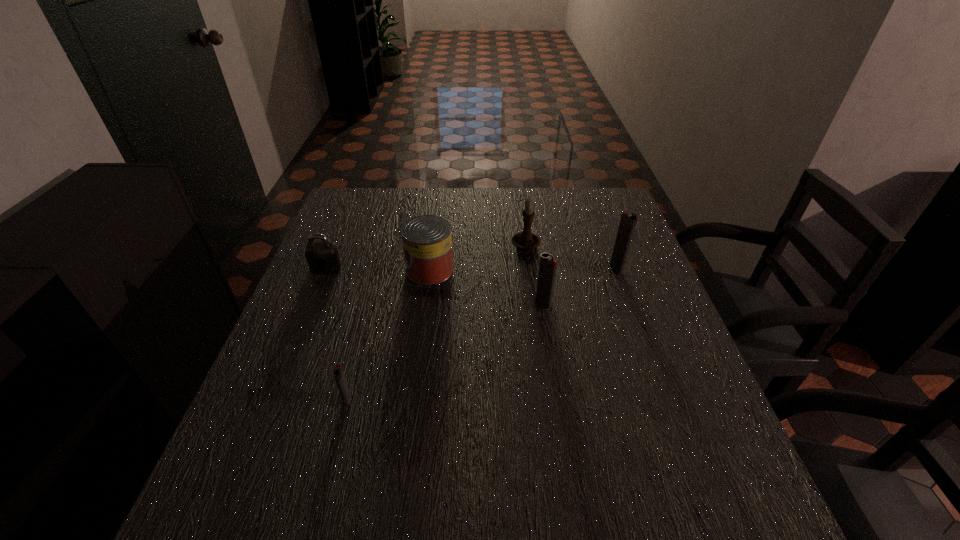
Locate an element on the screen. The width and height of the screenshot is (960, 540). free spot that satisfies the following two spatial constraints: 1. at the front of the padlock near the keyhole; 2. on the left side of the rightmost igniter is located at coordinates (325, 268).

Locate an element on the screen. This screenshot has height=540, width=960. free space that satisfies the following two spatial constraints: 1. at the front of the rightmost igniter near the keyhole; 2. on the right side of the padlock is located at coordinates (325, 268).

You are a GUI agent. You are given a task and a screenshot of the screen. Output one action in this format:
    pyautogui.click(x=<x>, y=<y>)
    Task: Click on the vacant space that satisfies the following two spatial constraints: 1. at the front of the padlock near the keyhole; 2. on the right side of the second igniter from left to right
    The width and height of the screenshot is (960, 540).
    Given the screenshot: What is the action you would take?
    pyautogui.click(x=311, y=304)

Locate an element on the screen. Image resolution: width=960 pixels, height=540 pixels. free space in the image that satisfies the following two spatial constraints: 1. at the front of the can near the keyhole; 2. on the left side of the padlock is located at coordinates (325, 270).